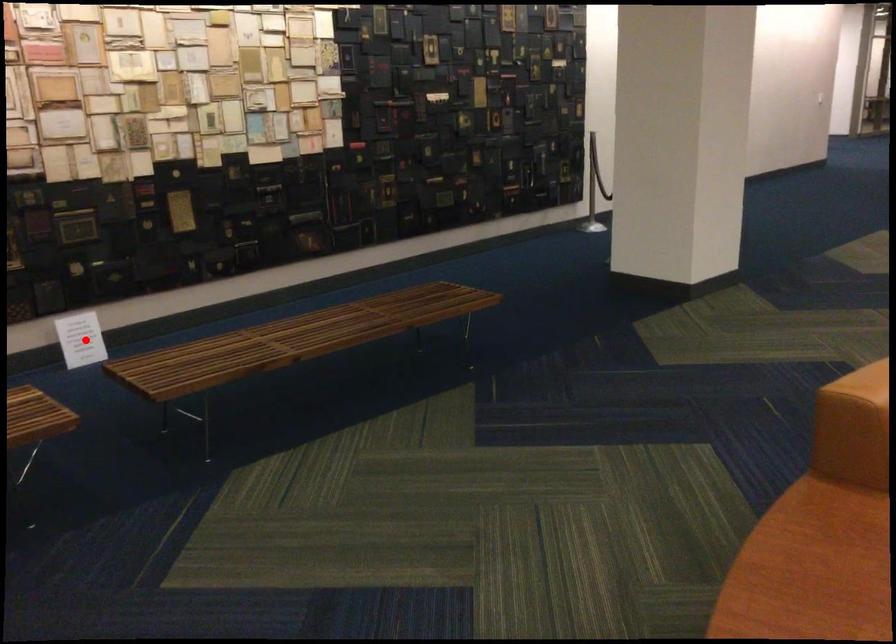
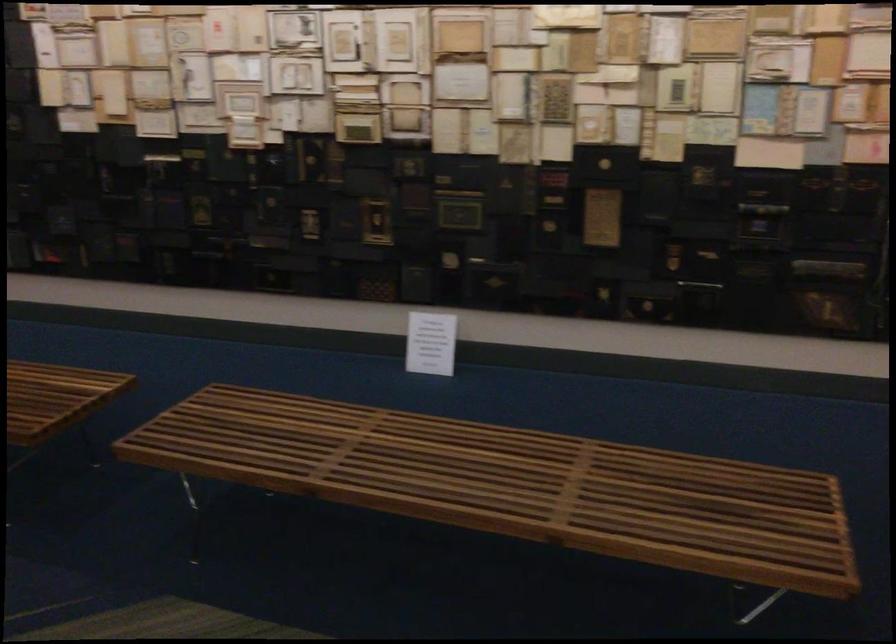
Question: I am providing you with two images of the same scene from different viewpoints. A red point is marked on the first image. At the location where the point appears in image 1, is it still visible in image 2?

Choices:
 (A) Yes
 (B) No

Answer: (A)